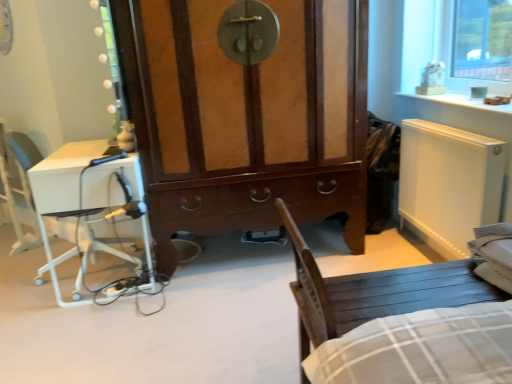
At what (x,y) coordinates should I click in order to perform the action: click on vacant area that lies to the right of white glossy desk at left. Please return your answer as a coordinate pair (x, y). Looking at the image, I should click on (207, 274).